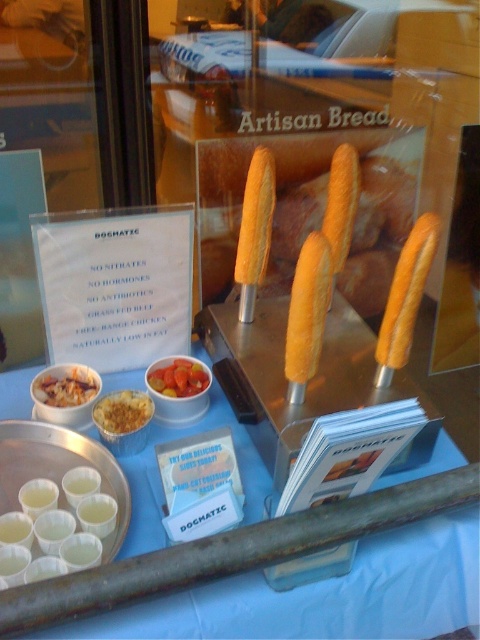
Question: Does golden crispy breadstick at center come behind vibrant orange carrot at center?

Choices:
 (A) no
 (B) yes

Answer: (A)

Question: Which of the following is the closest to the observer?

Choices:
 (A) golden crumbly topping at center
 (B) blue fabric table at center
 (C) golden crispy breadstick at center

Answer: (B)

Question: Can you confirm if golden breadstick at center is smaller than matte brown rice at center left?

Choices:
 (A) yes
 (B) no

Answer: (B)

Question: Which object is the closest to the blue fabric table at center?

Choices:
 (A) vibrant orange carrot at center
 (B) golden breadstick at center
 (C) golden crumbly topping at center
 (D) golden crispy breadstick at center

Answer: (C)

Question: Which object is positioned farthest from the golden crispy breadstick at center?

Choices:
 (A) golden crumbly topping at center
 (B) golden-brown crusty bread at center
 (C) blue fabric table at center

Answer: (C)

Question: From the image, what is the correct spatial relationship of matte brown rice at center left in relation to vibrant orange carrot at center?

Choices:
 (A) above
 (B) below

Answer: (B)